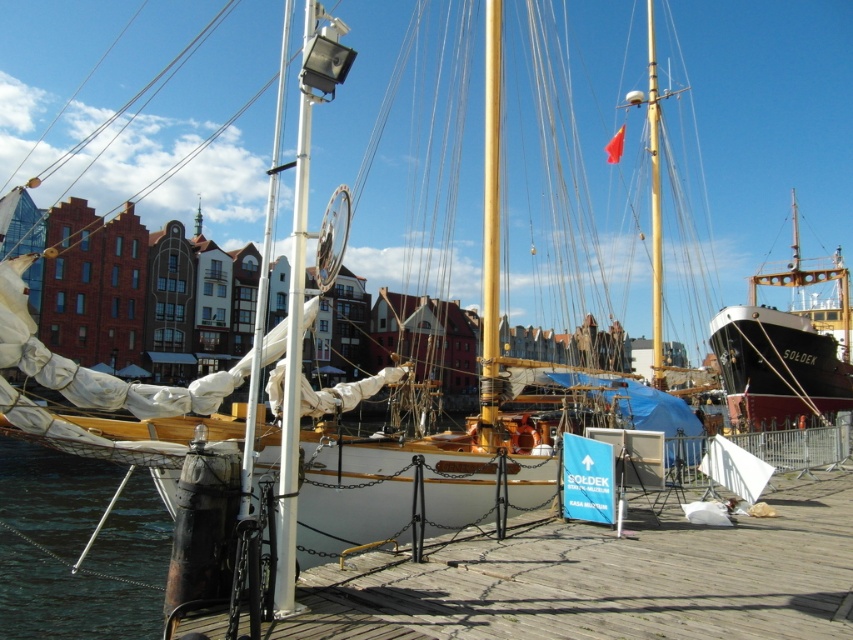
Question: Can you confirm if wooden at center is positioned to the right of yellow polished wood mast at center?

Choices:
 (A) no
 (B) yes

Answer: (A)

Question: Which point appears closest to the camera in this image?

Choices:
 (A) (656, 259)
 (B) (775, 416)
 (C) (33, 536)
 (D) (486, 106)

Answer: (D)

Question: Which point is closer to the camera taking this photo?

Choices:
 (A) (625, 556)
 (B) (490, 264)

Answer: (A)

Question: Considering the real-world distances, which object is farthest from the gold polished mast at center?

Choices:
 (A) clear water at lower left
 (B) wooden at center
 (C) black polished wood ship at right

Answer: (C)

Question: Is black polished wood ship at right positioned at the back of gold polished mast at center?

Choices:
 (A) yes
 (B) no

Answer: (A)

Question: Does black polished wood ship at right have a greater width compared to yellow polished wood mast at center?

Choices:
 (A) no
 (B) yes

Answer: (B)